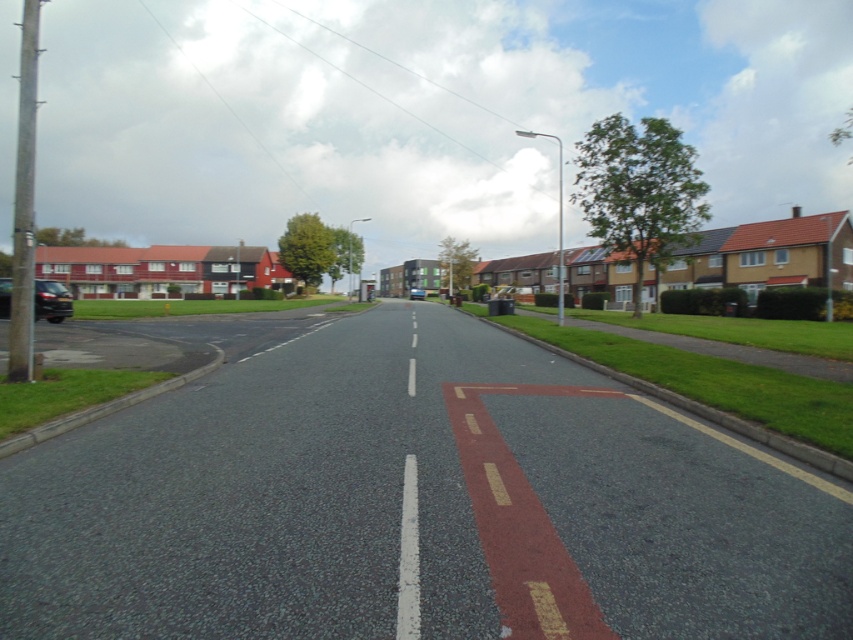
Can you confirm if shiny black car at left is thinner than matte black car at center?

In fact, shiny black car at left might be wider than matte black car at center.

Can you confirm if shiny black car at left is positioned to the left of matte black car at center?

Correct, you'll find shiny black car at left to the left of matte black car at center.

Does point (39, 314) come in front of point (412, 292)?

That is True.

You are a GUI agent. You are given a task and a screenshot of the screen. Output one action in this format:
    pyautogui.click(x=<x>, y=<y>)
    Task: Click on the shiny black car at left
    The width and height of the screenshot is (853, 640).
    Given the screenshot: What is the action you would take?
    pyautogui.click(x=51, y=300)